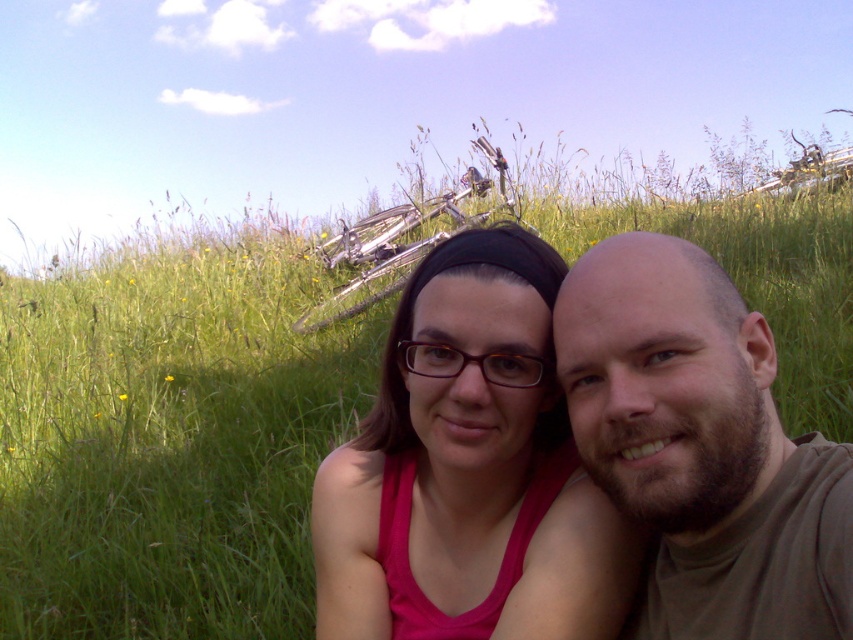
You are trying to decide which top to wear for a casual day out. Both the pink fabric tank top at center and the brown matte shirt at center are options. Based on their sizes shown in the image, which one has a wider silhouette?

The pink fabric tank top at center has a wider silhouette than the brown matte shirt at center, as its width is larger according to the description.

You are a photographer taking a picture of two people in a grassy field. You notice the pink fabric tank top at center and the brown matte shirt at center. Which clothing item appears larger in the photo?

The pink fabric tank top at center appears larger than the brown matte shirt at center in the photo.